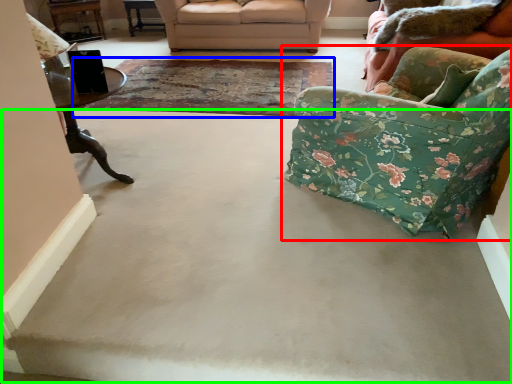
Question: Which object is the farthest from chair (highlighted by a red box)? Choose among these: mat (highlighted by a blue box) or concrete (highlighted by a green box).

Choices:
 (A) mat
 (B) concrete

Answer: (A)